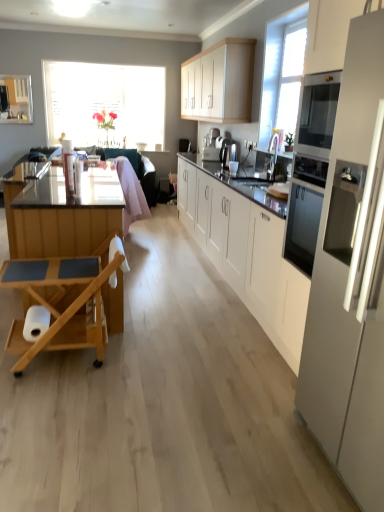
Question: Is white glossy refrigerator at right closer to the viewer compared to wooden rolling cart at left?

Choices:
 (A) no
 (B) yes

Answer: (B)

Question: Can you confirm if white glossy refrigerator at right is shorter than wooden rolling cart at left?

Choices:
 (A) yes
 (B) no

Answer: (B)

Question: From a real-world perspective, does white glossy refrigerator at right sit lower than wooden rolling cart at left?

Choices:
 (A) no
 (B) yes

Answer: (A)

Question: Is white glossy refrigerator at right aimed at wooden rolling cart at left?

Choices:
 (A) yes
 (B) no

Answer: (B)

Question: Is wooden rolling cart at left located within white glossy refrigerator at right?

Choices:
 (A) yes
 (B) no

Answer: (B)

Question: Is white glossy refrigerator at right at the right side of wooden rolling cart at left?

Choices:
 (A) yes
 (B) no

Answer: (A)

Question: Is the position of satin silver coffee machine at center more distant than that of translucent glass window at upper left?

Choices:
 (A) yes
 (B) no

Answer: (B)

Question: Does satin silver coffee machine at center appear on the right side of translucent glass window at upper left?

Choices:
 (A) no
 (B) yes

Answer: (B)

Question: Is satin silver coffee machine at center shorter than translucent glass window at upper left?

Choices:
 (A) yes
 (B) no

Answer: (A)

Question: Considering the relative positions of satin silver coffee machine at center and translucent glass window at upper left in the image provided, is satin silver coffee machine at center in front of translucent glass window at upper left?

Choices:
 (A) yes
 (B) no

Answer: (A)

Question: Considering the relative sizes of satin silver coffee machine at center and translucent glass window at upper left in the image provided, is satin silver coffee machine at center thinner than translucent glass window at upper left?

Choices:
 (A) no
 (B) yes

Answer: (B)

Question: From a real-world perspective, is satin silver coffee machine at center below translucent glass window at upper left?

Choices:
 (A) no
 (B) yes

Answer: (B)

Question: Can you confirm if white glossy refrigerator at right is thinner than white glossy sink at center?

Choices:
 (A) no
 (B) yes

Answer: (A)